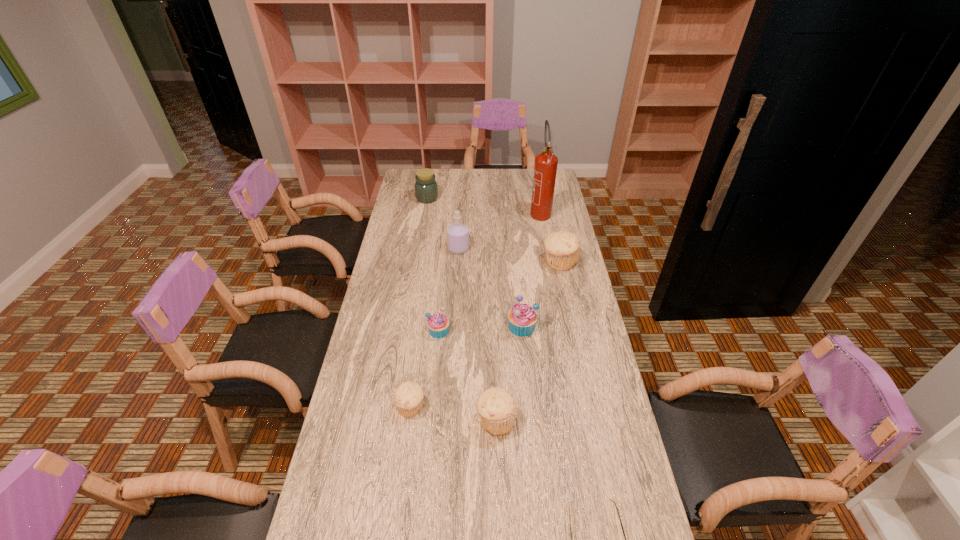
The height and width of the screenshot is (540, 960). What are the coordinates of `the leftmost beige muffin` in the screenshot? It's located at (408, 396).

What are the coordinates of `free space located 0.250m from the nozzle of the red fire extinguisher` in the screenshot? It's located at (548, 258).

Where is `vacant area situated 0.140m on the left of the perfume`? This screenshot has width=960, height=540. vacant area situated 0.140m on the left of the perfume is located at coordinates (416, 248).

At what (x,y) coordinates should I click in order to perform the action: click on vacant region located 0.370m on the right of the jar. Please return your answer as a coordinate pair (x, y). The height and width of the screenshot is (540, 960). Looking at the image, I should click on click(x=513, y=198).

At what (x,y) coordinates should I click in order to perform the action: click on free space located 0.150m on the back of the tallest muffin. Please return your answer as a coordinate pair (x, y). Looking at the image, I should click on (553, 231).

Identify the location of vacant position located 0.350m on the back of the bigger blue muffin. This screenshot has width=960, height=540. (516, 255).

The image size is (960, 540). Find the location of `vacant space located 0.390m on the left of the second biggest beige muffin`. vacant space located 0.390m on the left of the second biggest beige muffin is located at coordinates (345, 420).

The image size is (960, 540). I want to click on free space located on the back of the left blue muffin, so click(442, 304).

Locate an element on the screen. vacant space located on the right of the smallest beige muffin is located at coordinates [x=508, y=406].

This screenshot has width=960, height=540. I want to click on jar that is at the left edge, so click(426, 189).